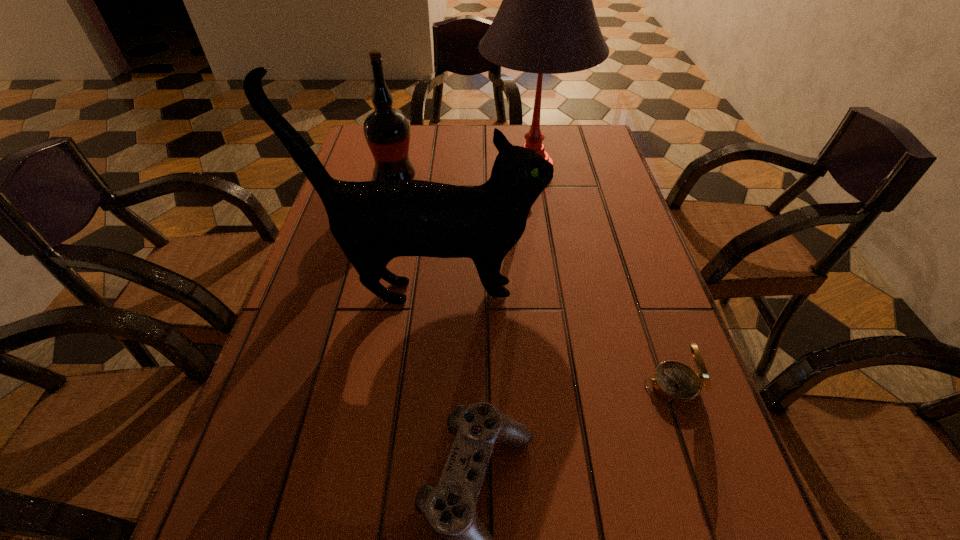
Locate an element on the screen. table lamp is located at coordinates (546, 24).

Locate an element on the screen. The width and height of the screenshot is (960, 540). cat is located at coordinates (373, 222).

I want to click on the third tallest object, so click(x=387, y=131).

Image resolution: width=960 pixels, height=540 pixels. Identify the location of the second nearest object. (677, 383).

Where is `the second shortest object`? the second shortest object is located at coordinates click(677, 383).

You are a GUI agent. You are given a task and a screenshot of the screen. Output one action in this format:
    pyautogui.click(x=<x>, y=<y>)
    Task: Click on the vacant space located 0.330m on the front-facing side of the table lamp
    Image resolution: width=960 pixels, height=540 pixels.
    Given the screenshot: What is the action you would take?
    pyautogui.click(x=364, y=170)

This screenshot has height=540, width=960. What are the coordinates of `vacant space located on the front-facing side of the table lamp` in the screenshot? It's located at (454, 170).

Identify the location of free space located 0.170m on the front-facing side of the table lamp. (420, 170).

Locate an element on the screen. blank space located on the face of the third farthest object is located at coordinates (598, 293).

What are the coordinates of `vacant space located 0.060m on the front of the third shortest object` in the screenshot? It's located at (389, 205).